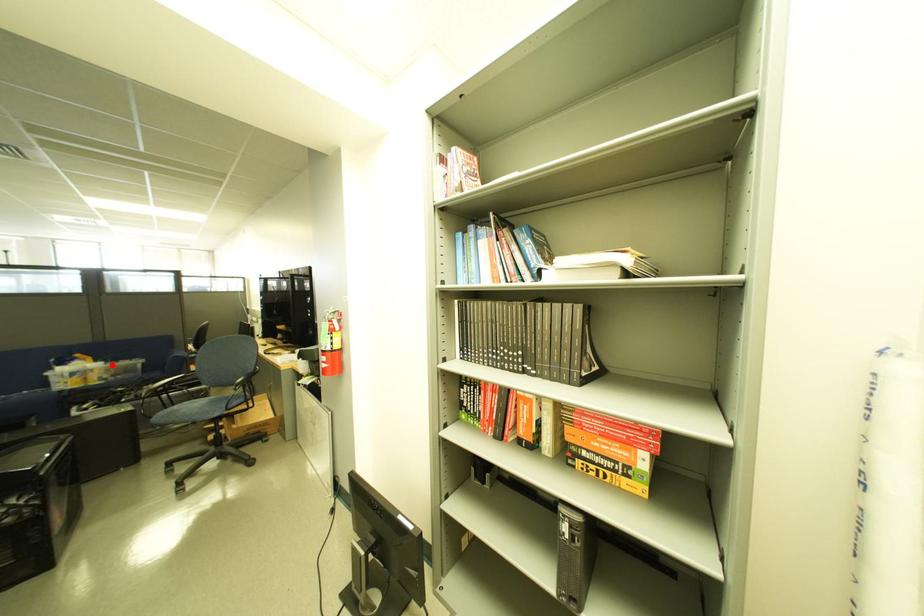
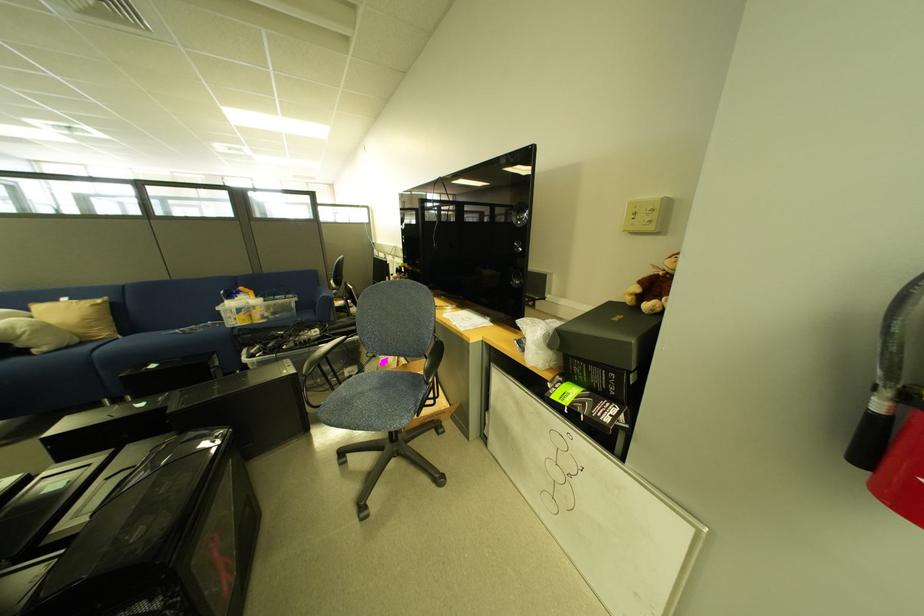
Locate, in the second image, the point that corresponds to the highlighted location in the first image.

(272, 302)